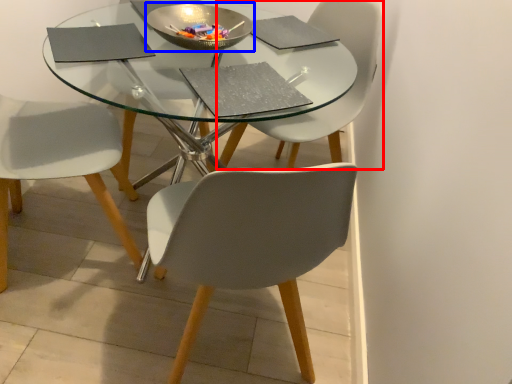
Question: Which object is closer to the camera taking this photo, chair (highlighted by a red box) or bowl (highlighted by a blue box)?

Choices:
 (A) chair
 (B) bowl

Answer: (B)